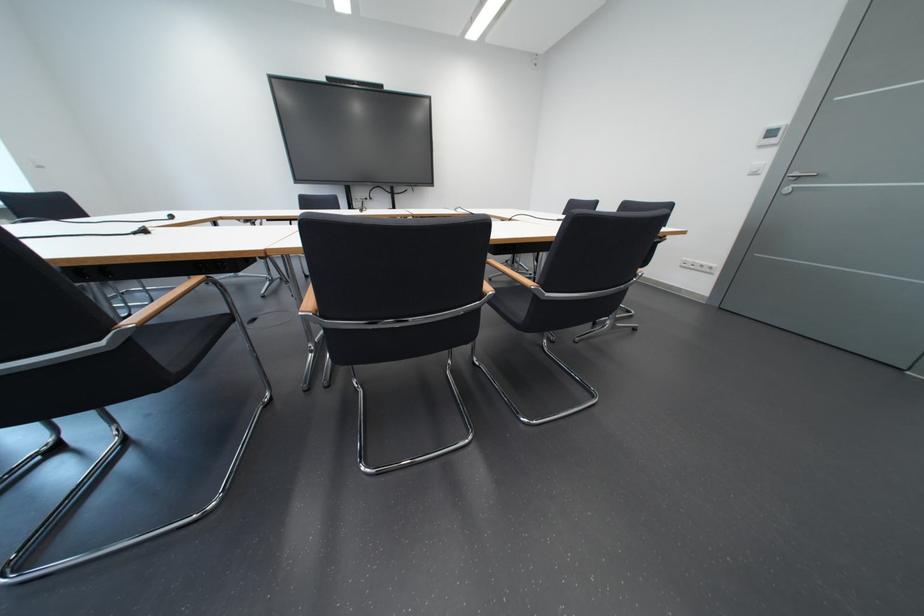
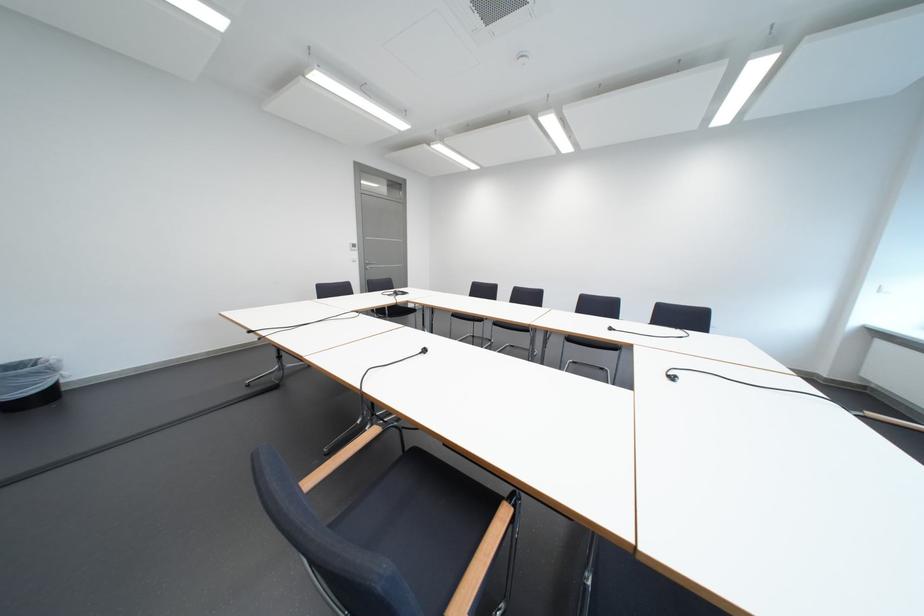
In the second image, find the point that corresponds to (771,182) in the first image.

(369, 265)